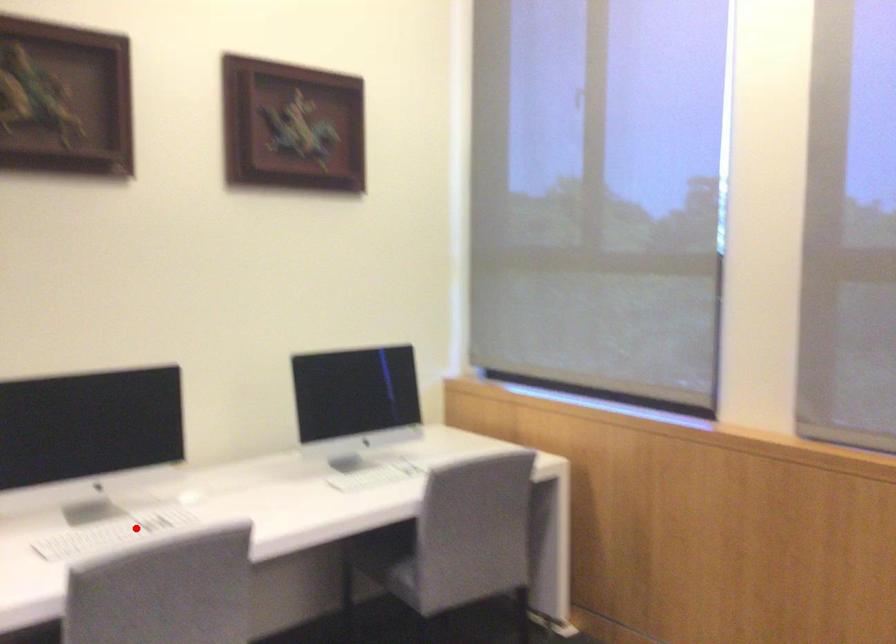
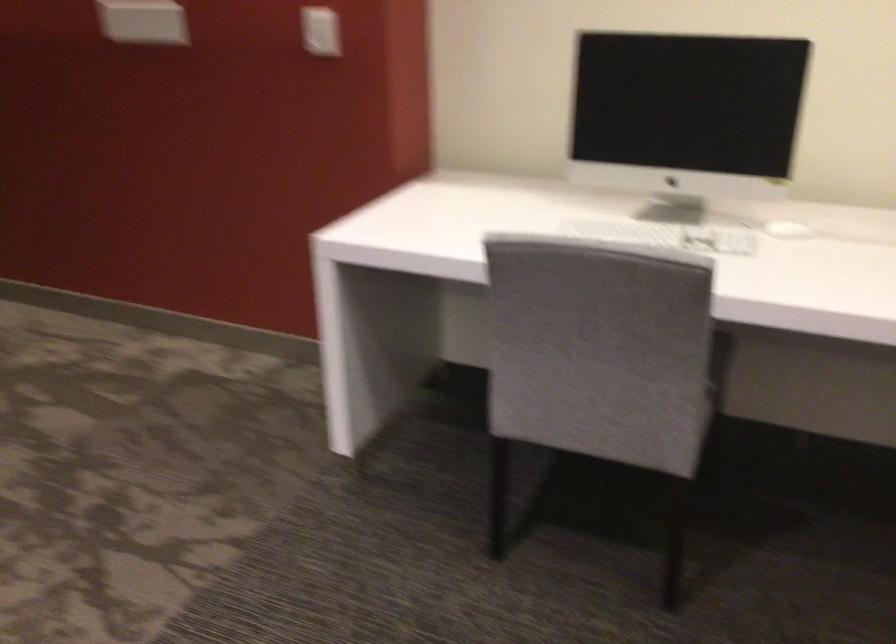
In the second image, find the point that corresponds to the highlighted location in the first image.

(666, 234)